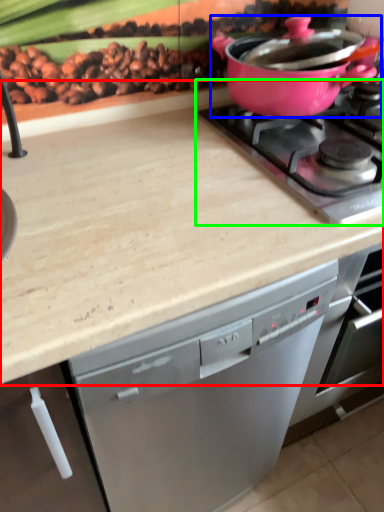
Question: Considering the real-world distances, which object is farthest from countertop (highlighted by a red box)? kitchen appliance (highlighted by a blue box) or gas stove (highlighted by a green box)?

Choices:
 (A) kitchen appliance
 (B) gas stove

Answer: (A)